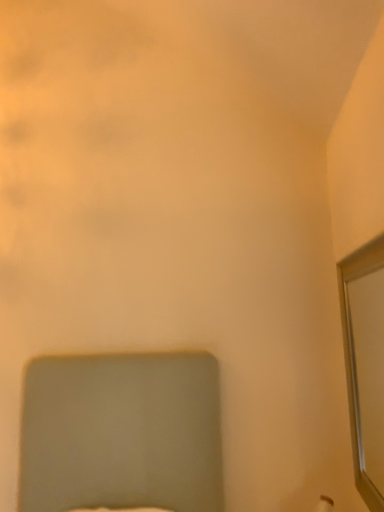
What is the approximate width of matte gray bed at lower center?

The width of matte gray bed at lower center is 1.67 meters.

This screenshot has height=512, width=384. What do you see at coordinates (121, 433) in the screenshot?
I see `matte gray bed at lower center` at bounding box center [121, 433].

I want to click on matte gray bed at lower center, so (x=121, y=433).

What do you see at coordinates (365, 364) in the screenshot? I see `white textured mirror at right` at bounding box center [365, 364].

The image size is (384, 512). Identify the location of white textured mirror at right. click(x=365, y=364).

This screenshot has height=512, width=384. I want to click on matte gray bed at lower center, so click(121, 433).

Can you confirm if matte gray bed at lower center is positioned to the right of white textured mirror at right?

No.

Does matte gray bed at lower center lie behind white textured mirror at right?

No, matte gray bed at lower center is in front of white textured mirror at right.

In the scene shown: Which point is more distant from viewer, (96, 423) or (382, 420)?

Point (96, 423)

From the image's perspective, between matte gray bed at lower center and white textured mirror at right, who is located below?

matte gray bed at lower center.

From a real-world perspective, relative to white textured mirror at right, is matte gray bed at lower center vertically above or below?

Clearly, from a real-world perspective, matte gray bed at lower center is below white textured mirror at right.

Is matte gray bed at lower center wider than white textured mirror at right?

Yes, matte gray bed at lower center is wider than white textured mirror at right.

Considering the relative sizes of matte gray bed at lower center and white textured mirror at right in the image provided, is matte gray bed at lower center shorter than white textured mirror at right?

Correct, matte gray bed at lower center is not as tall as white textured mirror at right.

Considering the sizes of objects matte gray bed at lower center and white textured mirror at right in the image provided, who is bigger, matte gray bed at lower center or white textured mirror at right?

matte gray bed at lower center is bigger.

Is matte gray bed at lower center located outside white textured mirror at right?

matte gray bed at lower center lies outside white textured mirror at right's area.

Are matte gray bed at lower center and white textured mirror at right located far from each other?

No, matte gray bed at lower center is not far from white textured mirror at right.

Is matte gray bed at lower center turned away from white textured mirror at right?

matte gray bed at lower center is not turned away from white textured mirror at right.

Find the location of a particular element. This screenshot has height=512, width=384. bed below the white textured mirror at right (from a real-world perspective) is located at coordinates (121, 433).

Considering the relative positions of white textured mirror at right and matte gray bed at lower center in the image provided, is white textured mirror at right to the left of matte gray bed at lower center from the viewer's perspective?

In fact, white textured mirror at right is to the right of matte gray bed at lower center.

Consider the image. Which object is further away from the camera, white textured mirror at right or matte gray bed at lower center?

white textured mirror at right.

Does point (351, 336) come in front of point (127, 423)?

Yes, it is.

From the image's perspective, is white textured mirror at right located beneath matte gray bed at lower center?

Actually, white textured mirror at right appears above matte gray bed at lower center in the image.

Based on the photo, from a real-world perspective, which object stands above the other?

white textured mirror at right is physically above.

In the scene shown: Which object is wider, white textured mirror at right or matte gray bed at lower center?

matte gray bed at lower center is wider.

Considering the relative sizes of white textured mirror at right and matte gray bed at lower center in the image provided, is white textured mirror at right shorter than matte gray bed at lower center?

Incorrect, the height of white textured mirror at right does not fall short of that of matte gray bed at lower center.

Is white textured mirror at right bigger or smaller than matte gray bed at lower center?

In the image, white textured mirror at right appears to be smaller than matte gray bed at lower center.

Is white textured mirror at right spatially inside matte gray bed at lower center, or outside of it?

white textured mirror at right exists outside the volume of matte gray bed at lower center.

Is white textured mirror at right far away from matte gray bed at lower center?

No, white textured mirror at right is in close proximity to matte gray bed at lower center.

Could you tell me if white textured mirror at right is turned towards matte gray bed at lower center?

Yes, white textured mirror at right is turned towards matte gray bed at lower center.

How much distance is there between white textured mirror at right and matte gray bed at lower center?

white textured mirror at right and matte gray bed at lower center are 35.37 inches apart.

I want to click on mirror above the matte gray bed at lower center (from the image's perspective), so click(x=365, y=364).

You are a GUI agent. You are given a task and a screenshot of the screen. Output one action in this format:
    pyautogui.click(x=<x>, y=<y>)
    Task: Click on the bed below the white textured mirror at right (from the image's perspective)
    
    Given the screenshot: What is the action you would take?
    pyautogui.click(x=121, y=433)

At what (x,y) coordinates should I click in order to perform the action: click on bed on the left of white textured mirror at right. Please return your answer as a coordinate pair (x, y). The height and width of the screenshot is (512, 384). Looking at the image, I should click on (121, 433).